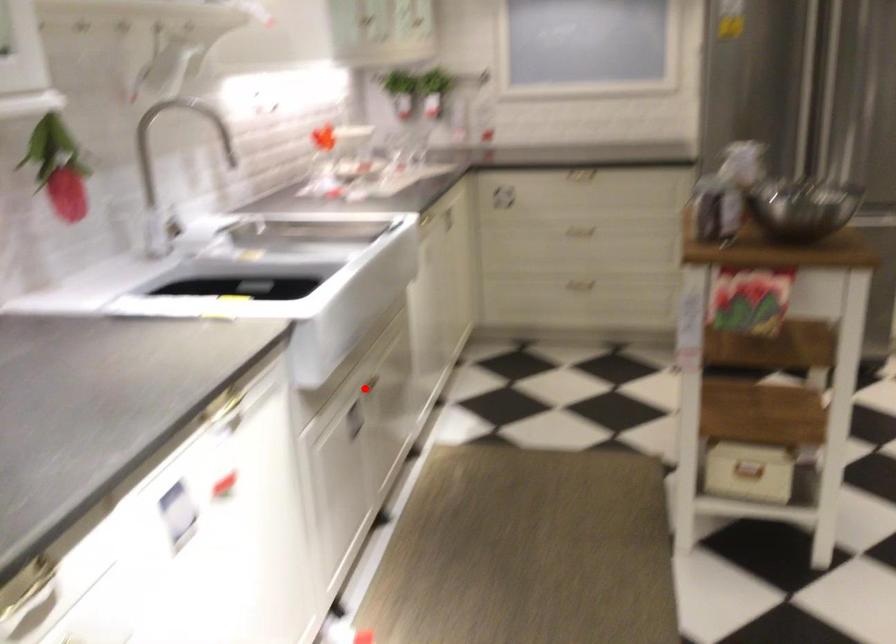
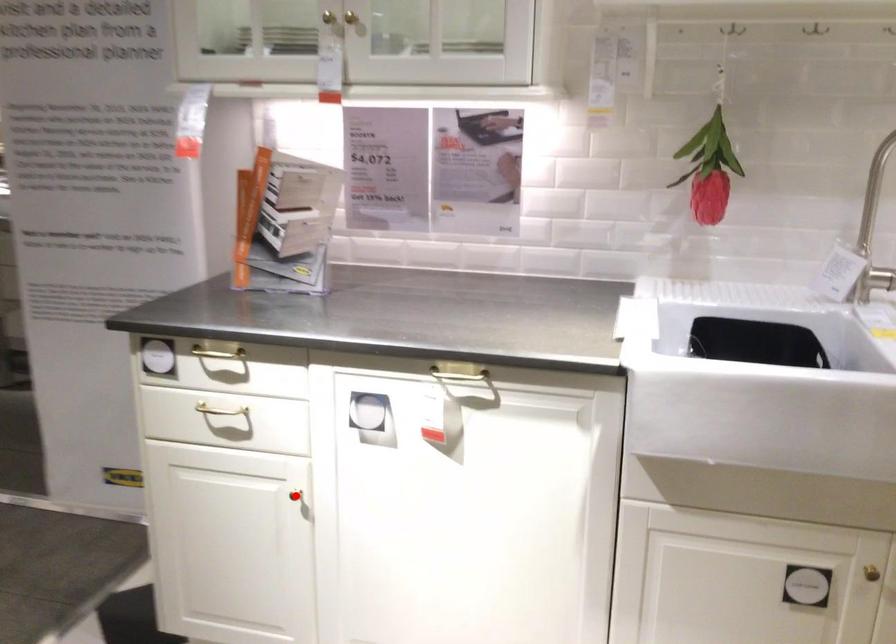
I am providing you with two images of the same scene from different viewpoints. A red point is marked on the first image and another point is marked on the second image. Do the highlighted points in image1 and image2 indicate the same real-world spot?

No